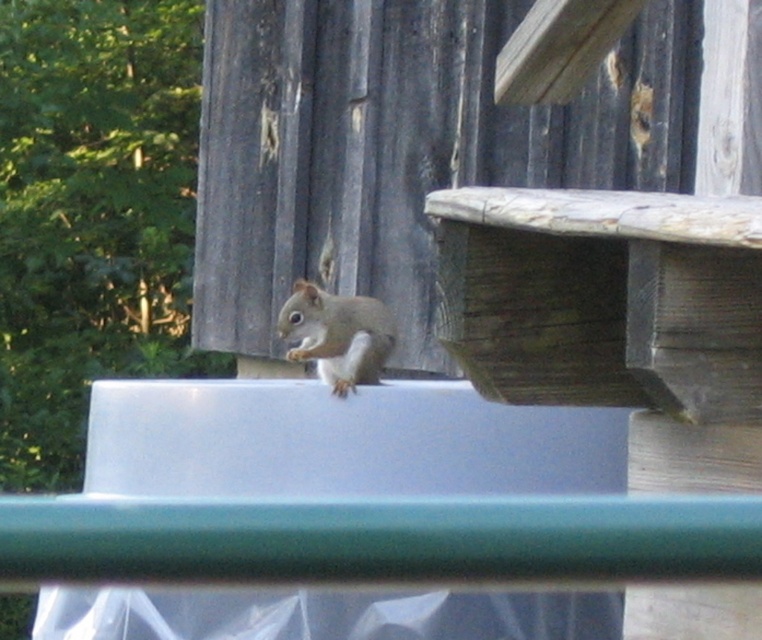
Which is behind, point (187, 464) or point (325, 353)?

Point (325, 353)

You are a GUI agent. You are given a task and a screenshot of the screen. Output one action in this format:
    pyautogui.click(x=<x>, y=<y>)
    Task: Click on the smooth plastic tray at upper center
    The height and width of the screenshot is (640, 762).
    Given the screenshot: What is the action you would take?
    pyautogui.click(x=341, y=442)